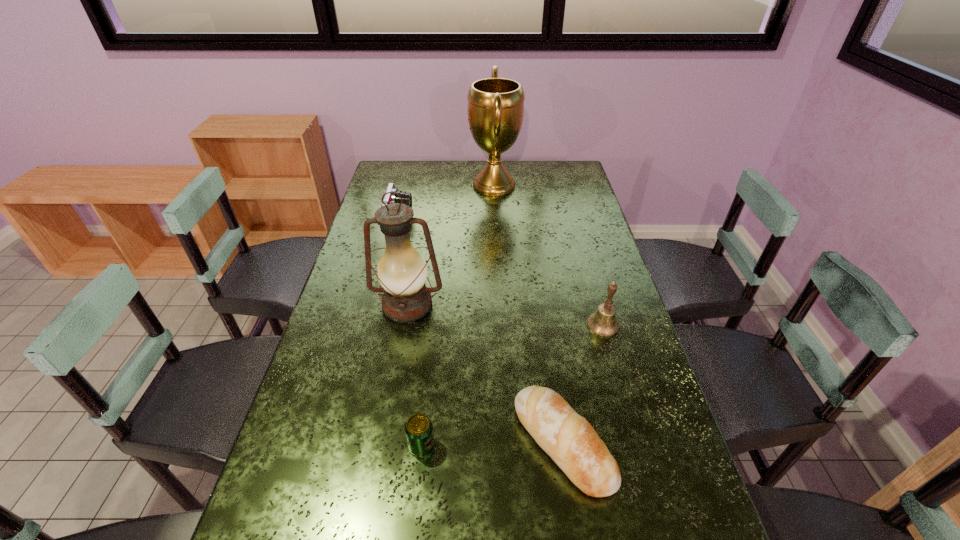
Locate an element on the screen. blank space located on the back of the oil lamp is located at coordinates [x=419, y=240].

Where is `vacant area located on the left of the fourth shortest object`? vacant area located on the left of the fourth shortest object is located at coordinates (556, 325).

Image resolution: width=960 pixels, height=540 pixels. What are the coordinates of `free location located on the front-facing side of the camera` in the screenshot? It's located at (485, 221).

Find the location of `vacant area situated on the back of the bread`. vacant area situated on the back of the bread is located at coordinates (541, 299).

Image resolution: width=960 pixels, height=540 pixels. Find the location of `vacant space located 0.310m on the right of the beer can`. vacant space located 0.310m on the right of the beer can is located at coordinates (570, 446).

Find the location of a particular element. Image resolution: width=960 pixels, height=540 pixels. object that is at the far edge is located at coordinates (495, 109).

Identify the location of oil lamp situated at the left edge. [x=402, y=272].

Where is `camera situated at the left edge`? This screenshot has height=540, width=960. camera situated at the left edge is located at coordinates (391, 198).

Where is `bell positioned at the right edge`? bell positioned at the right edge is located at coordinates (603, 323).

This screenshot has height=540, width=960. What are the coordinates of `bread that is at the right edge` in the screenshot? It's located at (568, 438).